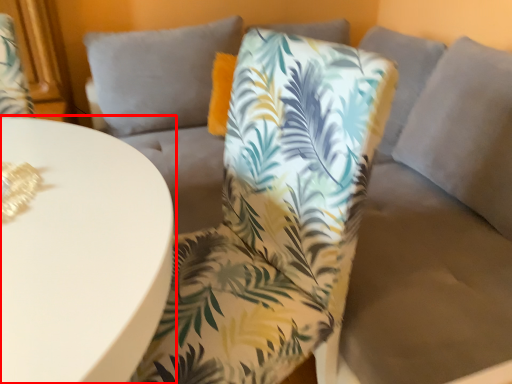
Question: Where is table (annotated by the red box) located in relation to chair in the image?

Choices:
 (A) left
 (B) right

Answer: (A)